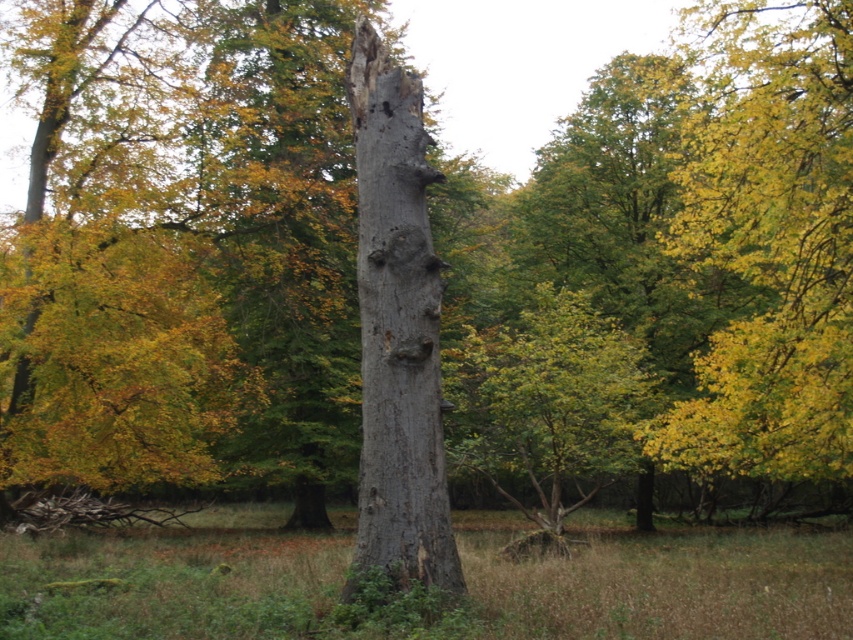
You are standing in the forest scene and want to determine which of the two points, point [817,77] or point [498,483], is nearer to you. Based on the image, which point is closer?

Point [817,77] is closer to the viewer than point [498,483].